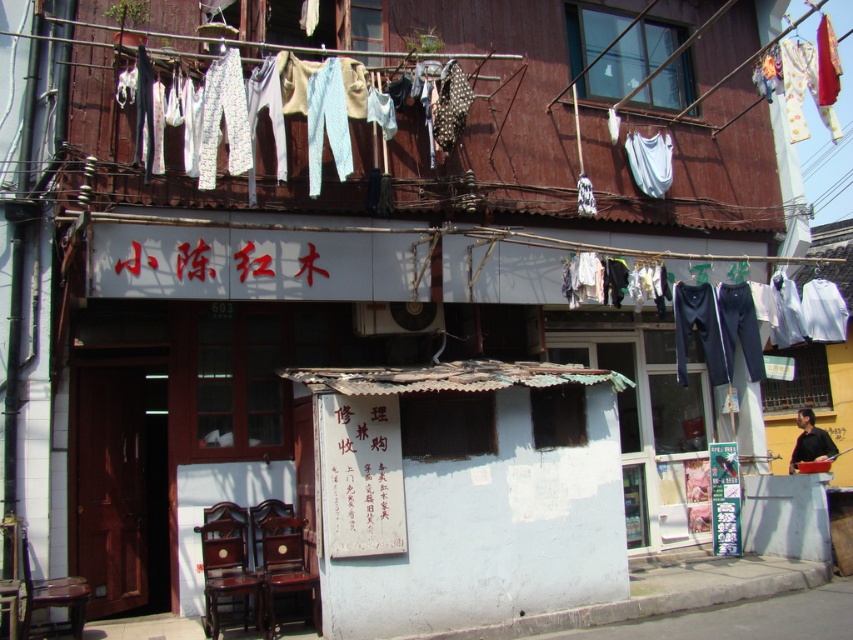
You are standing on the street looking at the building. You see a red fabric cloth at upper right and a wooden chair at lower left. Which object is closer to you?

The red fabric cloth at upper right is closer to you because it is further to the viewer than the wooden chair at lower left.

You are a delivery person standing in front of the shop. You need to place a package on the ground between the black paper sign at center and the mahogany wood chair at lower center. Is there enough space to place the package there?

The black paper sign at center is 38.17 inches away from the mahogany wood chair at lower center. Since the package requires some space to be placed, and the distance between them is over 3 feet, there is enough space to place the package between them.

You are a delivery person who needs to place a package on the mahogany wood chair at lower left. However, there is a black paper sign at center in the way. Can you place the package on the chair without moving the sign?

The black paper sign at center is positioned over the mahogany wood chair at lower left, so placing the package on the chair would require moving the sign first.